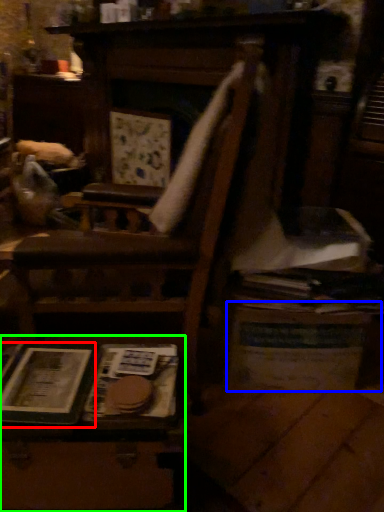
Question: Which object is the farthest from paperback book (highlighted by a red box)? Choose among these: table (highlighted by a blue box) or table (highlighted by a green box).

Choices:
 (A) table
 (B) table

Answer: (A)